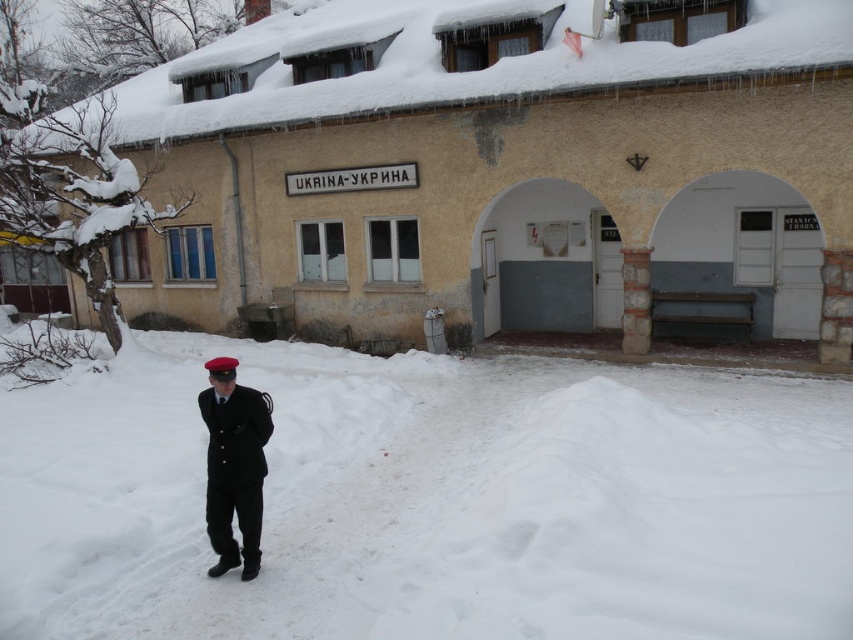
Based on the photo, is white fluffy snow at lower center bigger than black matte uniform at lower left?

Correct, white fluffy snow at lower center is larger in size than black matte uniform at lower left.

Describe the element at coordinates (431, 500) in the screenshot. I see `white fluffy snow at lower center` at that location.

Find the location of a particular element. This screenshot has width=853, height=640. white fluffy snow at lower center is located at coordinates (431, 500).